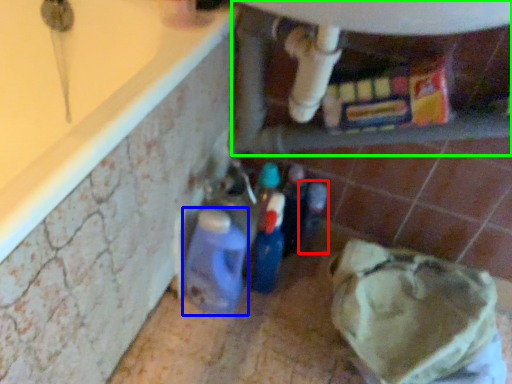
Question: Which object is positioned farthest from bottle (highlighted by a red box)? Select from bottle (highlighted by a blue box) and water heater (highlighted by a green box).

Choices:
 (A) bottle
 (B) water heater

Answer: (B)